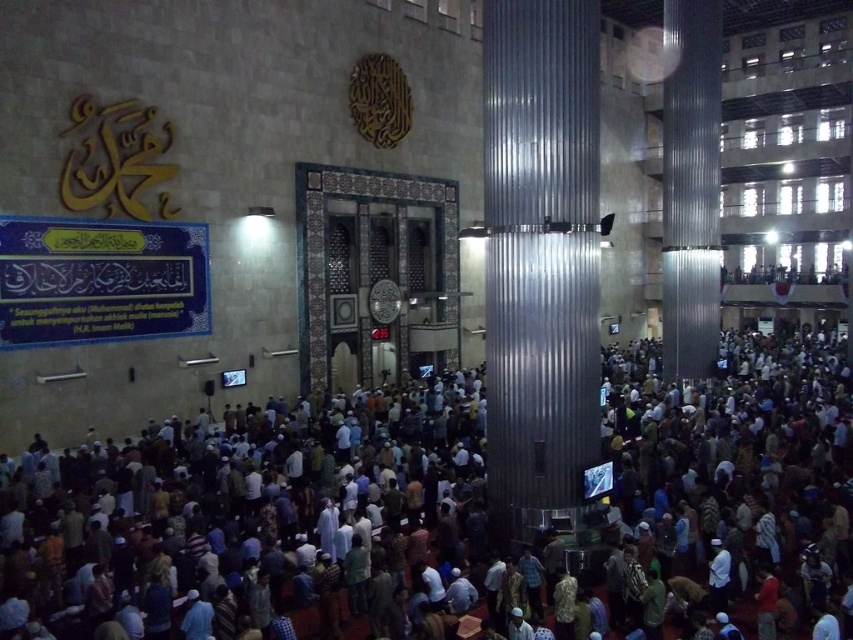
Does dark brown fabric crowd at center have a larger size compared to metallic corrugated pillar at center?

Yes.

Who is lower down, dark brown fabric crowd at center or metallic corrugated pillar at center?

dark brown fabric crowd at center

Is point (68, 588) behind point (521, 250)?

No, (68, 588) is closer to viewer.

Identify the location of dark brown fabric crowd at center. The width and height of the screenshot is (853, 640). (456, 515).

Is metallic corrugated pillar at center below metallic corrugated pillar at right?

Indeed, metallic corrugated pillar at center is positioned under metallic corrugated pillar at right.

Is point (498, 241) more distant than point (686, 360)?

No, it is not.

Where is `metallic corrugated pillar at center`? The image size is (853, 640). metallic corrugated pillar at center is located at coordinates (541, 260).

The image size is (853, 640). Identify the location of metallic corrugated pillar at center. (541, 260).

Is point (334, 422) positioned in front of point (708, 278)?

Yes, it is in front of point (708, 278).

Is dark brown fabric crowd at center in front of metallic corrugated pillar at right?

Yes, it is in front of metallic corrugated pillar at right.

Is point (3, 620) less distant than point (664, 26)?

Yes, point (3, 620) is in front of point (664, 26).

Where is `dark brown fabric crowd at center`? dark brown fabric crowd at center is located at coordinates (456, 515).